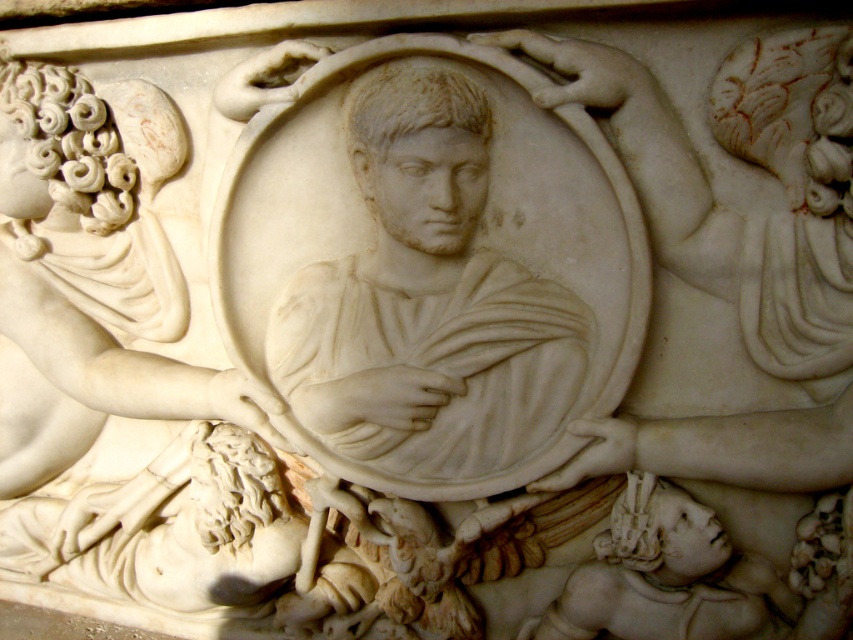
Consider the image. Based on the scene description, which object has a smaller width between the white marble bust at center and the white marble deity at center?

The white marble bust at center has a lesser width compared to the white marble deity at center.

Based on the photo, you are an art conservator tasked with installing a protective glass shield over the classical marble relief sculpture. The shield must cover both the white marble bust at center and the white marble deity at center without any overlap between them. Given the space between them, is this feasible?

The distance between the white marble bust at center and the white marble deity at center is 8.78 inches. Since the shield needs to cover both without overlapping, and the space between them is sufficient, it is feasible to install the protective glass shield as required.

You are an art conservator examining the marble relief sculpture. You notice two points on the sculpture at coordinates point (532, 316) and point (30, 157). Which point is closer to the viewer?

Point (532, 316) is in front of point (30, 157), so it is closer to the viewer.